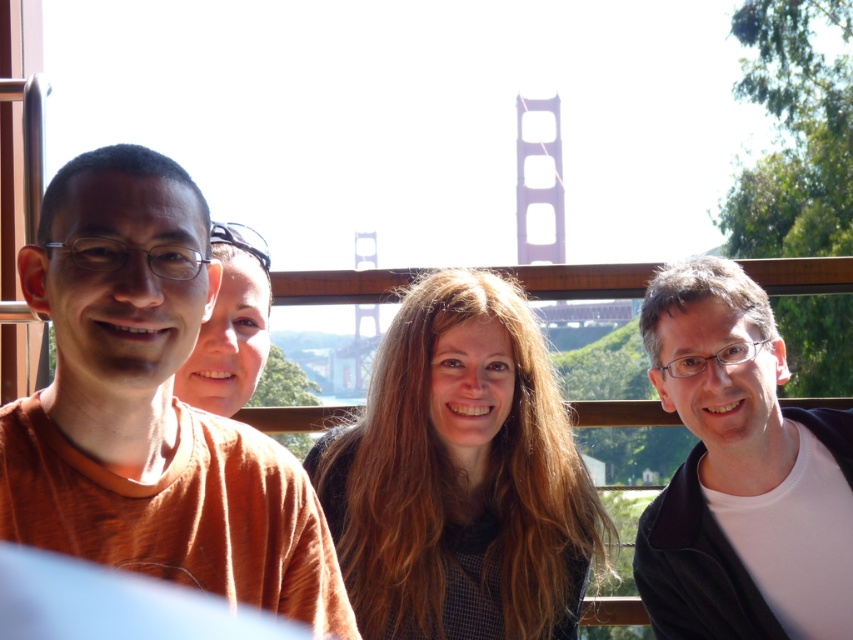
You are a photographer trying to capture a clear photo of the two subjects in the image. Which subject should you focus on to ensure the dark brown hair at center and the white matte shirt at right are both in focus?

To ensure both the dark brown hair at center and the white matte shirt at right are in focus, you should focus on the dark brown hair at center since it is in front of the white matte shirt at right, allowing the depth of field to cover both subjects.